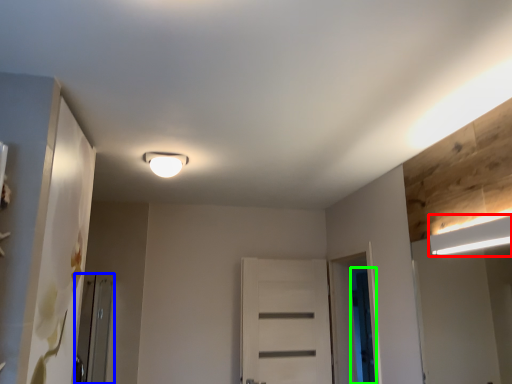
Question: Considering the real-world distances, which object is closest to lamp (highlighted by a red box)? screen door (highlighted by a blue box) or screen door (highlighted by a green box).

Choices:
 (A) screen door
 (B) screen door

Answer: (B)